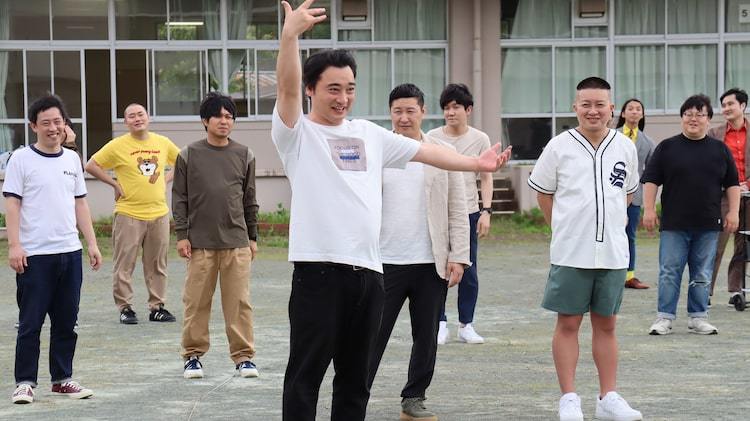
Identify the location of light on in building. (178, 22).